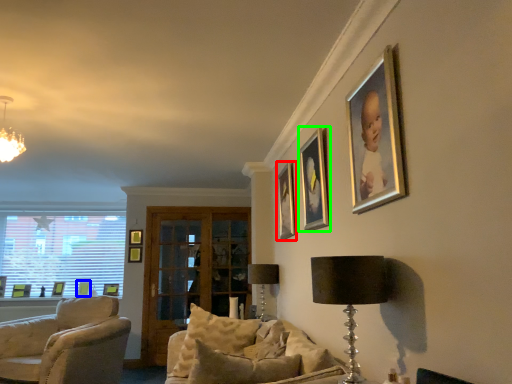
Question: Based on their relative distances, which object is nearer to picture frame (highlighted by a red box)? Choose from picture frame (highlighted by a blue box) and picture frame (highlighted by a green box).

Choices:
 (A) picture frame
 (B) picture frame

Answer: (B)